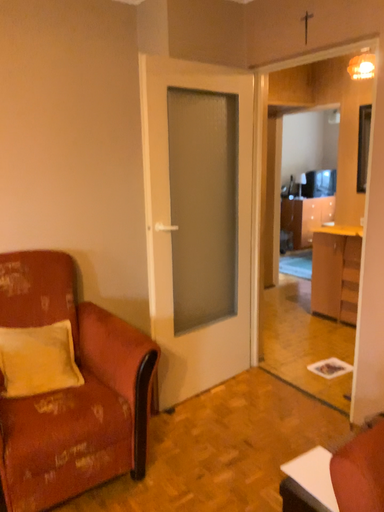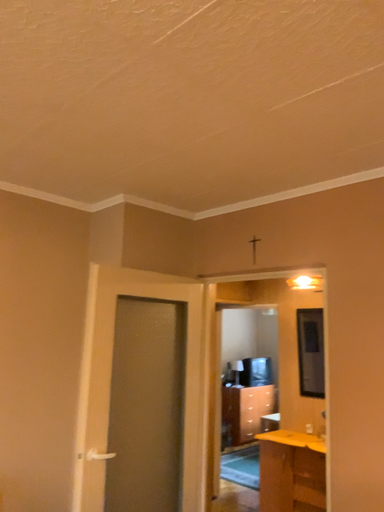
Question: How did the camera likely rotate when shooting the video?

Choices:
 (A) rotated upward
 (B) rotated downward

Answer: (A)